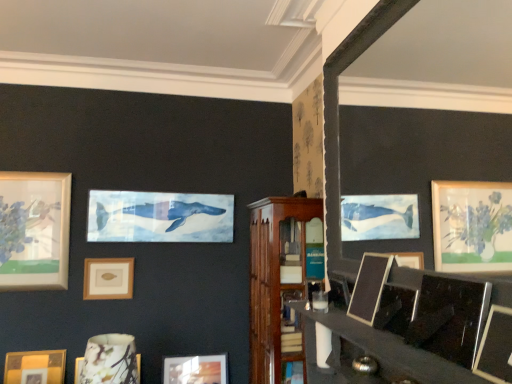
Question: Is the position of wooden cabinet at center more distant than that of matte wooden picture frame at lower center, the fourth picture frame positioned from the right?

Choices:
 (A) yes
 (B) no

Answer: (B)

Question: Is wooden cabinet at center at the right side of matte wooden picture frame at lower center, which ranks as the second picture frame in back-to-front order?

Choices:
 (A) yes
 (B) no

Answer: (A)

Question: Considering the relative sizes of wooden cabinet at center and matte wooden picture frame at lower center, which ranks as the second picture frame in back-to-front order, in the image provided, is wooden cabinet at center wider than matte wooden picture frame at lower center, which ranks as the second picture frame in back-to-front order,?

Choices:
 (A) yes
 (B) no

Answer: (A)

Question: Does wooden cabinet at center have a lesser width compared to matte wooden picture frame at lower center, the sixth picture frame in the front-to-back sequence?

Choices:
 (A) yes
 (B) no

Answer: (B)

Question: Is wooden cabinet at center positioned beyond the bounds of matte wooden picture frame at lower center, the sixth picture frame in the front-to-back sequence?

Choices:
 (A) no
 (B) yes

Answer: (B)

Question: Is wooden cabinet at center positioned in front of matte wooden picture frame at lower center, the sixth picture frame in the front-to-back sequence?

Choices:
 (A) no
 (B) yes

Answer: (B)

Question: Is matte wooden picture frame at lower center, which ranks as the second picture frame in back-to-front order, positioned with its back to matte gold picture frame at lower left, which ranks as the fourth picture frame in back-to-front order?

Choices:
 (A) no
 (B) yes

Answer: (A)

Question: Does matte wooden picture frame at lower center, marked as the fourth picture frame in a left-to-right arrangement, have a smaller size compared to matte gold picture frame at lower left, which ranks as the 4th picture frame in front-to-back order?

Choices:
 (A) yes
 (B) no

Answer: (B)

Question: From the image's perspective, does matte wooden picture frame at lower center, the sixth picture frame in the front-to-back sequence, appear lower than matte gold picture frame at lower left, the first picture frame when ordered from left to right?

Choices:
 (A) no
 (B) yes

Answer: (B)

Question: From the image's perspective, is matte wooden picture frame at lower center, the fourth picture frame positioned from the right, located above matte gold picture frame at lower left, the first picture frame when ordered from left to right?

Choices:
 (A) no
 (B) yes

Answer: (A)

Question: From a real-world perspective, is matte wooden picture frame at lower center, marked as the fourth picture frame in a left-to-right arrangement, positioned under matte gold picture frame at lower left, which ranks as the 4th picture frame in front-to-back order, based on gravity?

Choices:
 (A) yes
 (B) no

Answer: (A)

Question: Does matte wooden picture frame at lower center, the fourth picture frame positioned from the right, appear on the right side of matte gold picture frame at lower left, which ranks as the 4th picture frame in front-to-back order?

Choices:
 (A) yes
 (B) no

Answer: (A)

Question: Would you say matte ceramic vase at lower left, arranged as the 3th picture frame when viewed from the back, is part of matte gold picture frame at center-left, acting as the 7th picture frame starting from the front,'s contents?

Choices:
 (A) no
 (B) yes

Answer: (A)